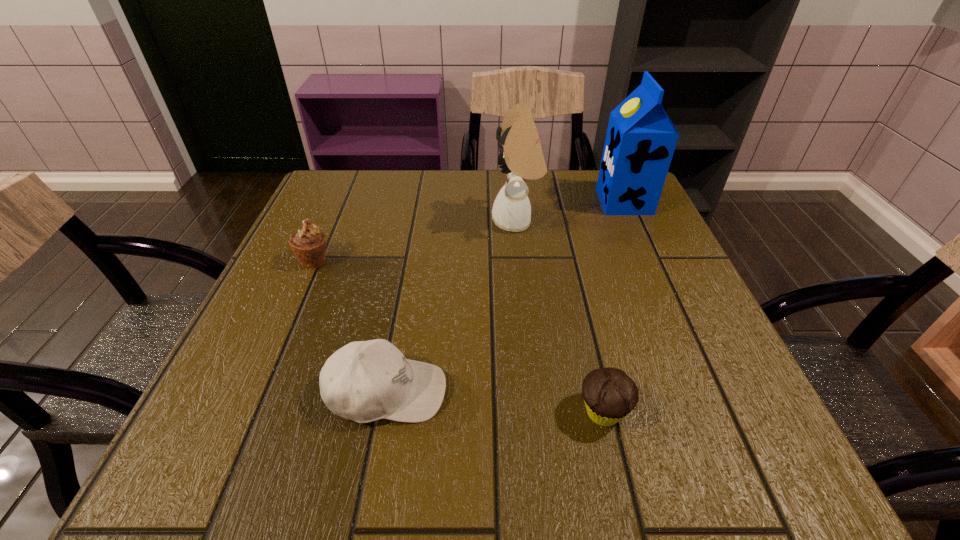
Where is `object present at the left edge`? The height and width of the screenshot is (540, 960). object present at the left edge is located at coordinates (308, 244).

Locate an element on the screen. The height and width of the screenshot is (540, 960). object located at the right edge is located at coordinates (640, 141).

Locate an element on the screen. object that is positioned at the far right corner is located at coordinates (640, 141).

Where is `blank space at the far edge of the desktop`? This screenshot has width=960, height=540. blank space at the far edge of the desktop is located at coordinates (480, 204).

This screenshot has height=540, width=960. In order to click on free space at the near edge of the desktop in this screenshot , I will do `click(564, 433)`.

In the image, there is a desktop. In order to click on vacant space at the left edge in this screenshot , I will do `click(253, 308)`.

You are a GUI agent. You are given a task and a screenshot of the screen. Output one action in this format:
    pyautogui.click(x=<x>, y=<y>)
    Task: Click on the free location at the right edge
    
    Given the screenshot: What is the action you would take?
    [x=686, y=380]

At what (x,y) coordinates should I click in order to perform the action: click on vacant region at the far left corner of the desktop. Please return your answer as a coordinate pair (x, y). The image size is (960, 540). Looking at the image, I should click on (365, 215).

The image size is (960, 540). Identify the location of vacant space at the near right corner of the desktop. (711, 427).

Where is `vacant area that lies between the third object from right to left and the fourth object from left to right`? This screenshot has width=960, height=540. vacant area that lies between the third object from right to left and the fourth object from left to right is located at coordinates (560, 316).